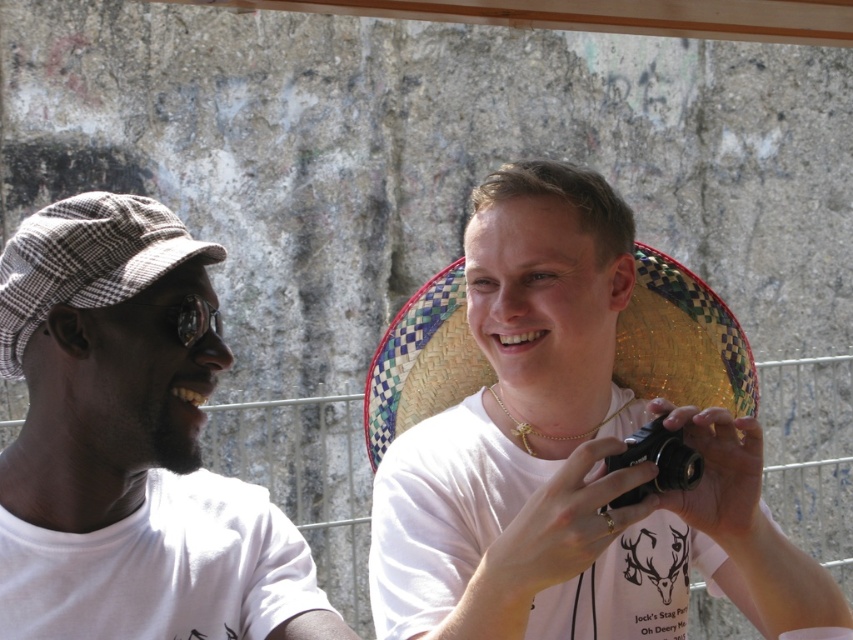
You are a photographer trying to decide where to place your equipment. You have a white matte camera at center and a white cotton shirt at left. Since you need to arrange items from left to right in order of increasing width, which should come first?

The white matte camera at center has a lesser width compared to the white cotton shirt at left, so it should come first in the arrangement from left to right in order of increasing width.

You are standing at the origin point in the image. You need to hand a camera to the person on the right. Which direction should you move to reach the white matte camera at center located at point (567, 458)?

The white matte camera at center is located at point (567, 458), so you should move towards the center of the image to reach it.

You are a photographer trying to decide where to place your equipment. You have a white matte camera at center and a white cotton shirt at left. Given their sizes, which item should you prioritize placing in a smaller storage compartment?

The white matte camera at center should be prioritized in the smaller storage compartment since it has a smaller size compared to the white cotton shirt at left.